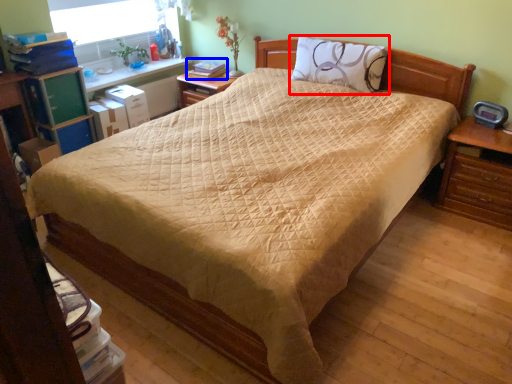
Question: Which point is closer to the camera, pillow (highlighted by a red box) or book (highlighted by a blue box)?

Choices:
 (A) pillow
 (B) book

Answer: (A)